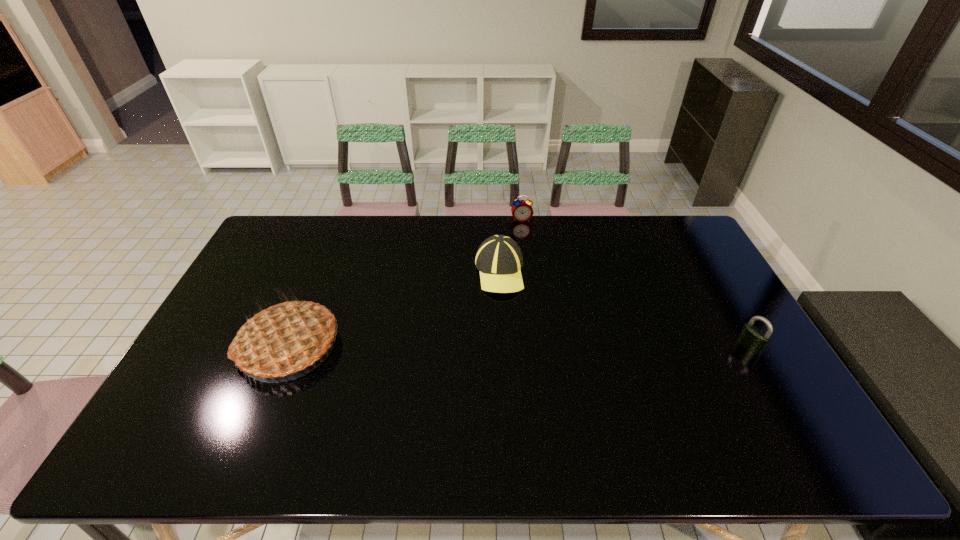
Where is `the tallest object`? The height and width of the screenshot is (540, 960). the tallest object is located at coordinates (284, 338).

At what (x,y) coordinates should I click in order to perform the action: click on pie. Please return your answer as a coordinate pair (x, y). Looking at the image, I should click on click(284, 338).

Find the location of a particular element. Image resolution: width=960 pixels, height=540 pixels. padlock is located at coordinates (752, 338).

Where is `baseball cap`? The height and width of the screenshot is (540, 960). baseball cap is located at coordinates (499, 259).

Locate an element on the screen. The height and width of the screenshot is (540, 960). alarm clock is located at coordinates (522, 211).

This screenshot has height=540, width=960. In order to click on free space located 0.150m on the right of the tallest object in this screenshot , I will do `click(392, 346)`.

The width and height of the screenshot is (960, 540). I want to click on free space located 0.080m on the back of the padlock, so (732, 316).

Identify the location of free location located 0.380m with the brim of the third nearest object facing forward. The height and width of the screenshot is (540, 960). (477, 401).

At what (x,y) coordinates should I click in order to perform the action: click on vacant space situated 0.310m with the brim of the third nearest object facing forward. Please return your answer as a coordinate pair (x, y). This screenshot has height=540, width=960. Looking at the image, I should click on (482, 378).

You are a GUI agent. You are given a task and a screenshot of the screen. Output one action in this format:
    pyautogui.click(x=<x>, y=<y>)
    Task: Click on the vacant space located with the brim of the third nearest object facing forward
    This screenshot has width=960, height=540.
    Given the screenshot: What is the action you would take?
    pyautogui.click(x=479, y=394)